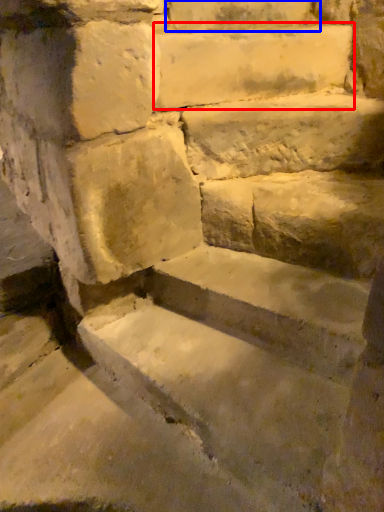
Question: Which object appears closest to the camera in this image, limestone (highlighted by a red box) or brick (highlighted by a blue box)?

Choices:
 (A) limestone
 (B) brick

Answer: (A)